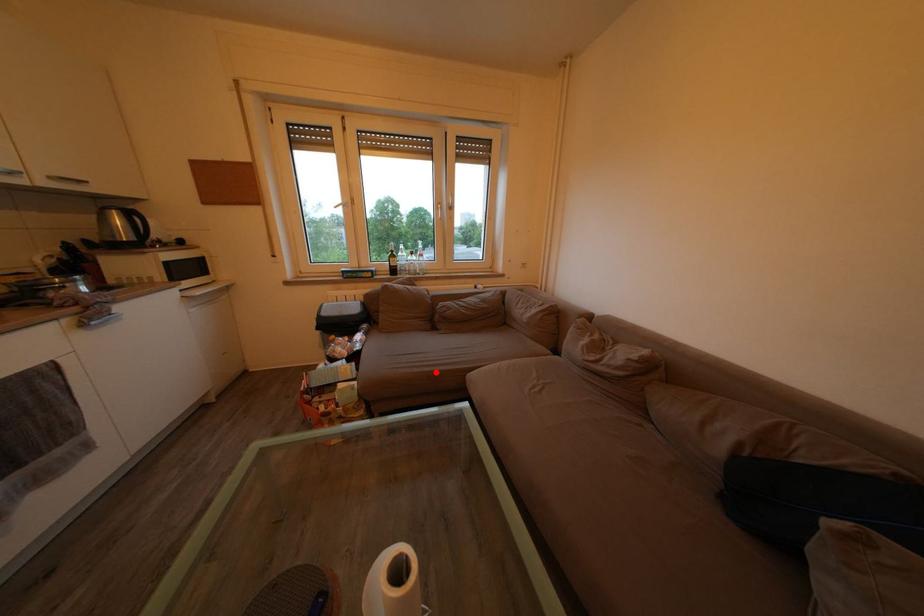
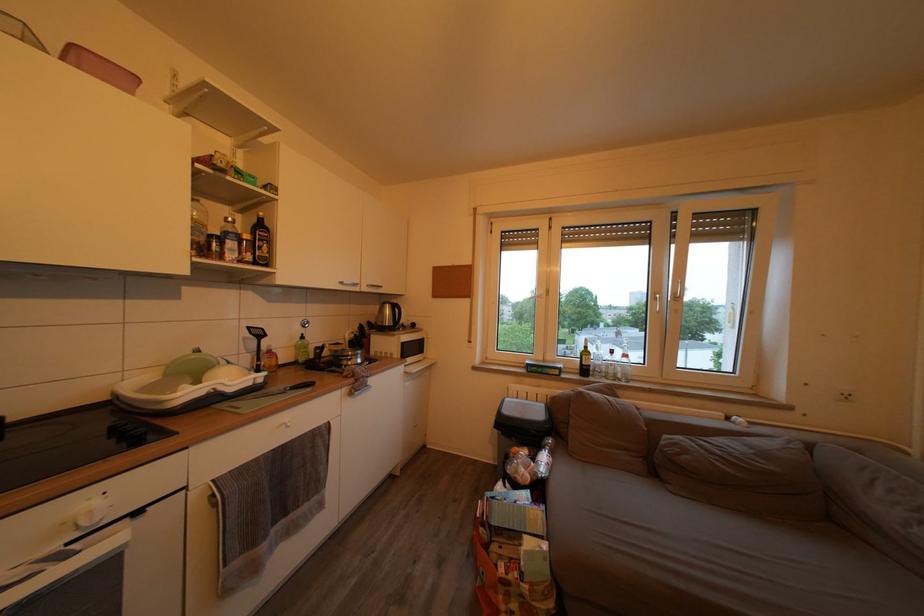
Locate, in the second image, the point that corresponds to the highlighted location in the first image.

(685, 580)